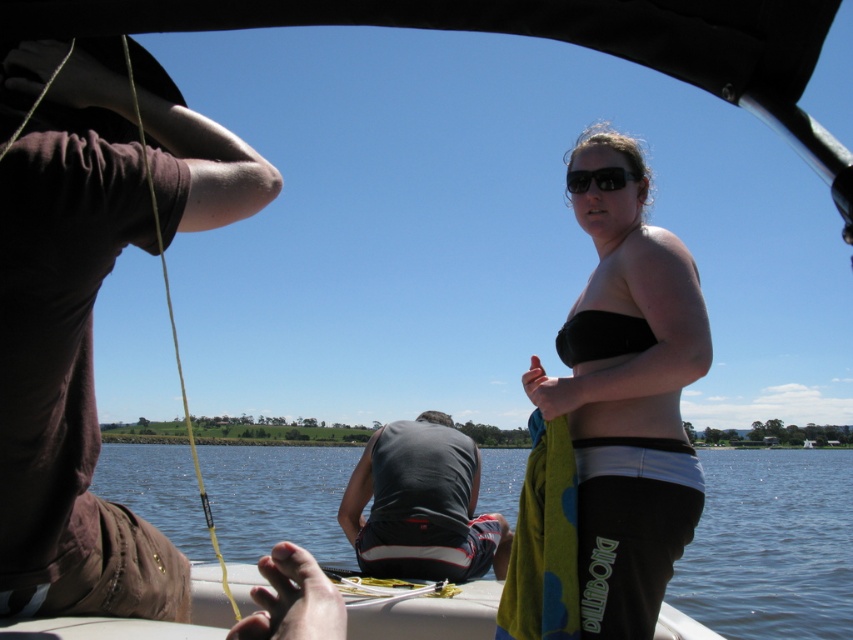
Which is in front, point (485, 529) or point (619, 180)?

Point (619, 180) is in front.

Does dark gray fabric shirt at center have a smaller size compared to black matte sunglasses at upper center?

No.

At what (x,y) coordinates should I click in order to perform the action: click on dark gray fabric shirt at center. Please return your answer as a coordinate pair (x, y). This screenshot has width=853, height=640. Looking at the image, I should click on (421, 506).

Between brown cotton shirt at upper left and black matte bikini top at center, which one is positioned higher?

Positioned higher is black matte bikini top at center.

Can you confirm if brown cotton shirt at upper left is wider than black matte bikini top at center?

Yes, brown cotton shirt at upper left is wider than black matte bikini top at center.

Is point (149, 534) farther from camera compared to point (640, 317)?

No, (149, 534) is in front of (640, 317).

The height and width of the screenshot is (640, 853). In order to click on brown cotton shirt at upper left in this screenshot , I will do coord(67,385).

Does brown cotton shirt at upper left have a larger size compared to black matte bikini top at upper right?

No.

Where is `brown cotton shirt at upper left`? The width and height of the screenshot is (853, 640). brown cotton shirt at upper left is located at coordinates (67, 385).